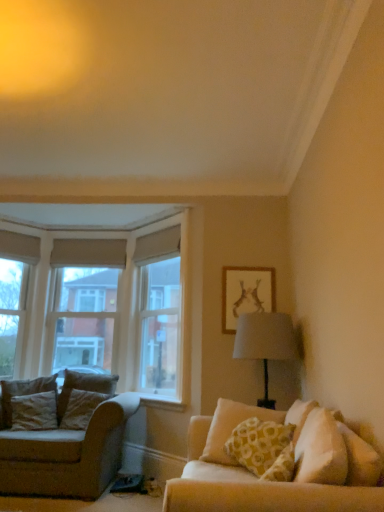
Question: From the image's perspective, is yellow printed cushion at right, the third pillow positioned from the back, over beige fabric couch at left?

Choices:
 (A) no
 (B) yes

Answer: (B)

Question: Is yellow printed cushion at right, the third pillow positioned from the back, smaller than beige fabric couch at left?

Choices:
 (A) no
 (B) yes

Answer: (B)

Question: From a real-world perspective, is yellow printed cushion at right, which appears as the 3th pillow when viewed from the left, below beige fabric couch at left?

Choices:
 (A) no
 (B) yes

Answer: (A)

Question: Does yellow printed cushion at right, the third pillow positioned from the back, have a lesser width compared to beige fabric couch at left?

Choices:
 (A) yes
 (B) no

Answer: (A)

Question: Can you confirm if yellow printed cushion at right, the 1th pillow when ordered from front to back, is positioned to the left of beige fabric couch at left?

Choices:
 (A) yes
 (B) no

Answer: (B)

Question: Does yellow printed cushion at right, the 1th pillow when ordered from front to back, appear on the right side of beige fabric couch at left?

Choices:
 (A) no
 (B) yes

Answer: (B)

Question: From the image's perspective, is matte gold picture frame at upper right on velvet brown pillow at left, acting as the 2th pillow starting from the back?

Choices:
 (A) yes
 (B) no

Answer: (A)

Question: Can velvet brown pillow at left, positioned as the third pillow in right-to-left order, be found inside matte gold picture frame at upper right?

Choices:
 (A) no
 (B) yes

Answer: (A)

Question: Does matte gold picture frame at upper right appear on the right side of velvet brown pillow at left, positioned as the 2th pillow in front-to-back order?

Choices:
 (A) no
 (B) yes

Answer: (B)

Question: Can you confirm if matte gold picture frame at upper right is smaller than velvet brown pillow at left, acting as the 2th pillow starting from the back?

Choices:
 (A) no
 (B) yes

Answer: (B)

Question: Is matte gold picture frame at upper right positioned with its back to velvet brown pillow at left, acting as the 2th pillow starting from the back?

Choices:
 (A) no
 (B) yes

Answer: (A)

Question: Does matte gold picture frame at upper right have a larger size compared to velvet brown pillow at left, positioned as the third pillow in right-to-left order?

Choices:
 (A) yes
 (B) no

Answer: (B)

Question: Considering the relative sizes of velvet beige pillow at left, the 1th pillow positioned from the back, and beige fabric couch at left in the image provided, is velvet beige pillow at left, the 1th pillow positioned from the back, thinner than beige fabric couch at left?

Choices:
 (A) no
 (B) yes

Answer: (B)